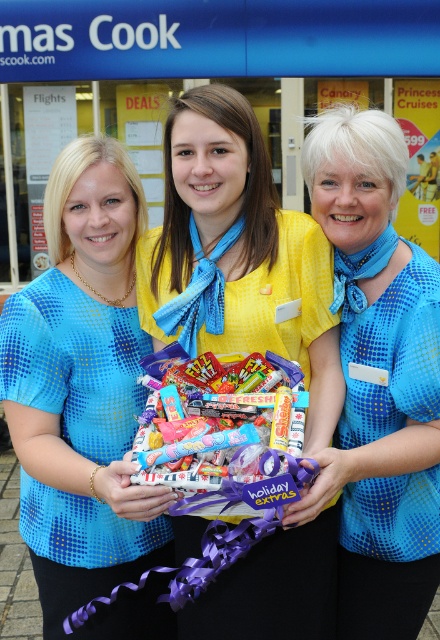
Question: Estimate the real-world distances between objects in this image. Which object is closer to the blue dotted shirt at center?

Choices:
 (A) yellow fabric shirt at center
 (B) shiny plastic candy at center
 (C) matte blue blouse at center

Answer: (A)

Question: Can you confirm if yellow fabric shirt at center is thinner than shiny plastic candy at center?

Choices:
 (A) yes
 (B) no

Answer: (B)

Question: Observing the image, what is the correct spatial positioning of matte blue blouse at center in reference to yellow fabric shirt at center?

Choices:
 (A) right
 (B) left

Answer: (B)

Question: Which point appears closest to the camera in this image?

Choices:
 (A) (403, 476)
 (B) (211, 595)
 (C) (18, 358)

Answer: (B)

Question: Can you confirm if yellow fabric shirt at center is positioned below shiny plastic candy at center?

Choices:
 (A) yes
 (B) no

Answer: (B)

Question: Which point is closer to the camera?

Choices:
 (A) (140, 557)
 (B) (249, 356)
 (C) (377, 234)

Answer: (B)